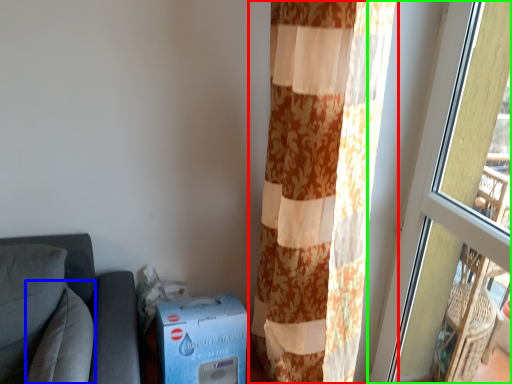
Question: Estimate the real-world distances between objects in this image. Which object is closer to curtain (highlighted by a red box), pillow (highlighted by a blue box) or window (highlighted by a green box)?

Choices:
 (A) pillow
 (B) window

Answer: (B)